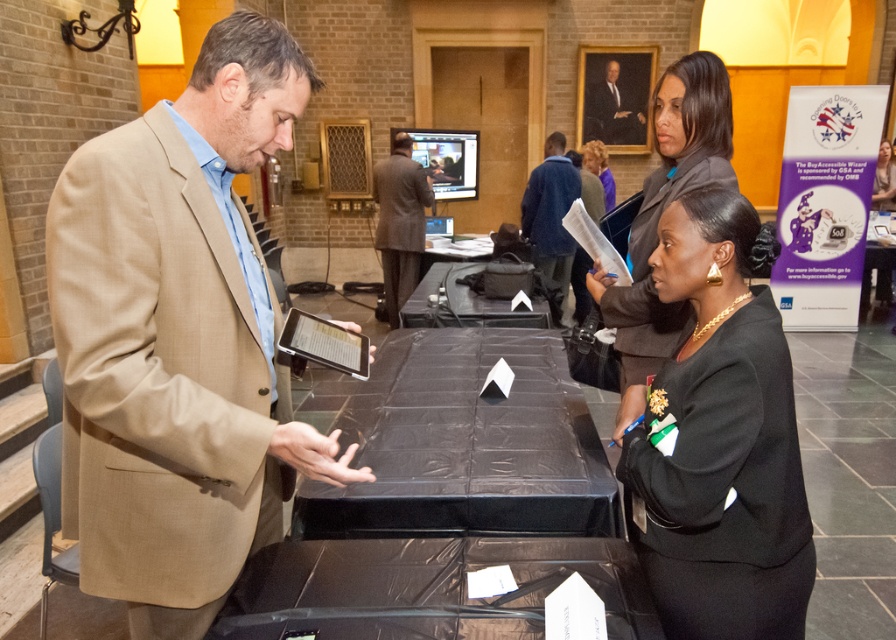
You are a photographer at the event and want to capture both the black satin blazer at center and the blue woolen sweater at center in a single photo. Which one should you focus on to ensure both are in sharp focus?

You should focus on the black satin blazer at center because it is closer to the viewer than the blue woolen sweater at center, so focusing on it will keep both in focus.

You are attending a formal event and notice two items of interest in the scene described. The first is the black satin blazer at center, and the second is the oil painting portrait at upper center. Which of these two items is taller?

The black satin blazer at center is taller than the oil painting portrait at upper center.

You are organizing a charity event and need to decide which jacket to display in a small showcase. Based on the sizes of the black satin blazer at center and the black fabric jacket at upper right, which one would fit better in a compact space?

The black satin blazer at center has a smaller size compared to the black fabric jacket at upper right, so it would fit better in a compact showcase.